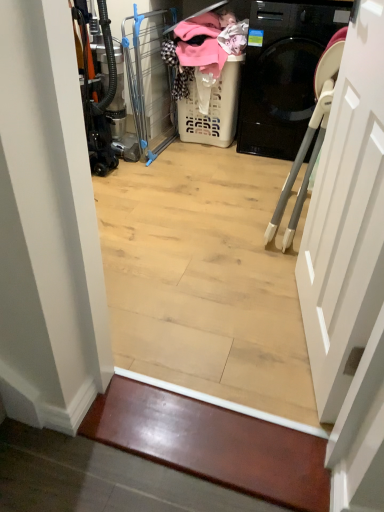
Question: Considering the relative sizes of clear plastic screen door at center and shiny wood stair at lower center in the image provided, is clear plastic screen door at center taller than shiny wood stair at lower center?

Choices:
 (A) yes
 (B) no

Answer: (A)

Question: Does clear plastic screen door at center appear on the left side of shiny wood stair at lower center?

Choices:
 (A) yes
 (B) no

Answer: (A)

Question: Considering the relative sizes of clear plastic screen door at center and shiny wood stair at lower center in the image provided, is clear plastic screen door at center thinner than shiny wood stair at lower center?

Choices:
 (A) yes
 (B) no

Answer: (B)

Question: Is clear plastic screen door at center shorter than shiny wood stair at lower center?

Choices:
 (A) no
 (B) yes

Answer: (A)

Question: Can you confirm if clear plastic screen door at center is smaller than shiny wood stair at lower center?

Choices:
 (A) yes
 (B) no

Answer: (B)

Question: Is there a large distance between clear plastic screen door at center and shiny wood stair at lower center?

Choices:
 (A) no
 (B) yes

Answer: (B)

Question: From a real-world perspective, is white plastic laundry basket at center positioned under clear plastic screen door at center based on gravity?

Choices:
 (A) yes
 (B) no

Answer: (A)

Question: Considering the relative positions of white plastic laundry basket at center and clear plastic screen door at center in the image provided, is white plastic laundry basket at center in front of clear plastic screen door at center?

Choices:
 (A) yes
 (B) no

Answer: (B)

Question: Considering the relative positions of white plastic laundry basket at center and clear plastic screen door at center in the image provided, is white plastic laundry basket at center to the right of clear plastic screen door at center from the viewer's perspective?

Choices:
 (A) yes
 (B) no

Answer: (A)

Question: Is white plastic laundry basket at center shorter than clear plastic screen door at center?

Choices:
 (A) yes
 (B) no

Answer: (A)

Question: Would you say white plastic laundry basket at center contains clear plastic screen door at center?

Choices:
 (A) yes
 (B) no

Answer: (B)

Question: Is white plastic laundry basket at center to the left of clear plastic screen door at center from the viewer's perspective?

Choices:
 (A) no
 (B) yes

Answer: (A)

Question: Considering the relative sizes of white matte door at right and white plastic laundry basket at center in the image provided, is white matte door at right thinner than white plastic laundry basket at center?

Choices:
 (A) yes
 (B) no

Answer: (A)